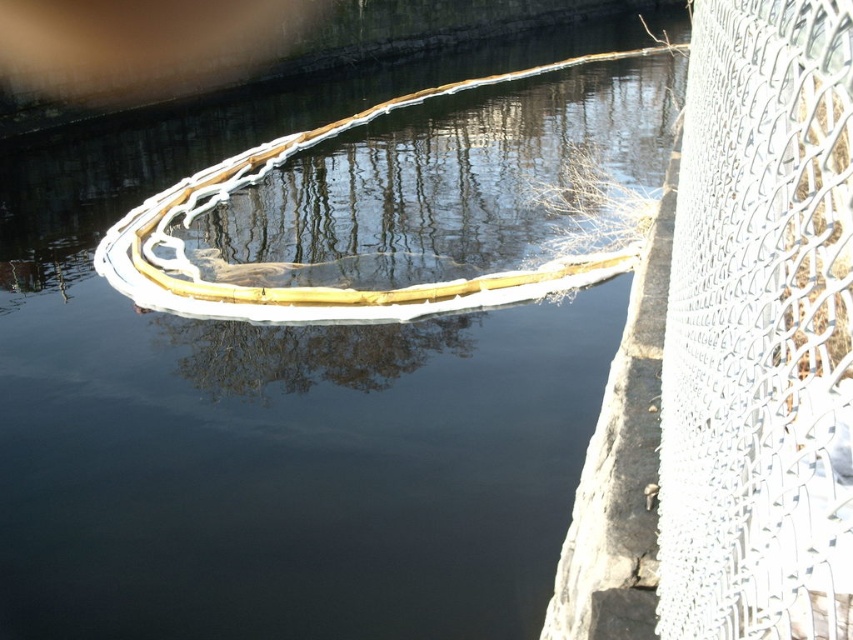
Question: Is the position of white wire mesh fence at right more distant than that of wooden boat at center?

Choices:
 (A) no
 (B) yes

Answer: (A)

Question: Can you confirm if white wire mesh fence at right is wider than wooden boat at center?

Choices:
 (A) yes
 (B) no

Answer: (B)

Question: Which of the following is the closest to the observer?

Choices:
 (A) (157, 228)
 (B) (722, 250)

Answer: (B)

Question: Can you confirm if white wire mesh fence at right is positioned above wooden boat at center?

Choices:
 (A) yes
 (B) no

Answer: (B)

Question: Which of the following is the farthest from the observer?

Choices:
 (A) (815, 284)
 (B) (189, 186)

Answer: (B)